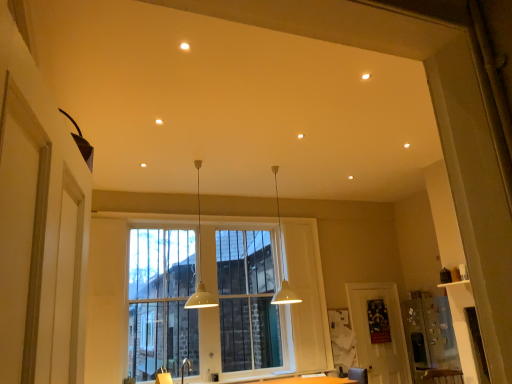
Question: Does clear glass window at center turn towards white matte pendant light at center, the first lamp positioned from the left?

Choices:
 (A) no
 (B) yes

Answer: (B)

Question: Considering the relative positions of clear glass window at center and white matte pendant light at center, the first lamp positioned from the left, in the image provided, is clear glass window at center to the right of white matte pendant light at center, the first lamp positioned from the left, from the viewer's perspective?

Choices:
 (A) yes
 (B) no

Answer: (B)

Question: Considering the relative sizes of clear glass window at center and white matte pendant light at center, the first lamp positioned from the left, in the image provided, is clear glass window at center smaller than white matte pendant light at center, the first lamp positioned from the left,?

Choices:
 (A) yes
 (B) no

Answer: (B)

Question: Is white matte pendant light at center, the 2th lamp in the right-to-left sequence, a part of clear glass window at center?

Choices:
 (A) yes
 (B) no

Answer: (B)

Question: Can you confirm if clear glass window at center is bigger than white matte pendant light at center, the first lamp positioned from the left?

Choices:
 (A) no
 (B) yes

Answer: (B)

Question: Considering the relative sizes of clear glass window at center and white matte pendant light at center, the 2th lamp in the right-to-left sequence, in the image provided, is clear glass window at center shorter than white matte pendant light at center, the 2th lamp in the right-to-left sequence,?

Choices:
 (A) no
 (B) yes

Answer: (A)

Question: Would you say clear glass window at center is part of matte white screen door at lower right's contents?

Choices:
 (A) no
 (B) yes

Answer: (A)

Question: Is matte white screen door at lower right positioned in front of clear glass window at center?

Choices:
 (A) yes
 (B) no

Answer: (B)

Question: Are matte white screen door at lower right and clear glass window at center far apart?

Choices:
 (A) yes
 (B) no

Answer: (A)

Question: From the image's perspective, is matte white screen door at lower right on top of clear glass window at center?

Choices:
 (A) no
 (B) yes

Answer: (A)

Question: Considering the relative sizes of matte white screen door at lower right and clear glass window at center in the image provided, is matte white screen door at lower right taller than clear glass window at center?

Choices:
 (A) no
 (B) yes

Answer: (A)

Question: Can you confirm if matte white screen door at lower right is smaller than clear glass window at center?

Choices:
 (A) yes
 (B) no

Answer: (A)

Question: Considering the relative sizes of white matte pendant light at center, the 2th lamp when ordered from left to right, and clear glass window at center in the image provided, is white matte pendant light at center, the 2th lamp when ordered from left to right, bigger than clear glass window at center?

Choices:
 (A) no
 (B) yes

Answer: (A)